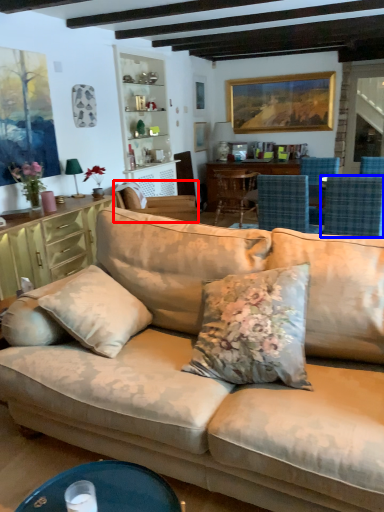
Question: Which of the following is the farthest to the observer, chair (highlighted by a red box) or chair (highlighted by a blue box)?

Choices:
 (A) chair
 (B) chair

Answer: (A)